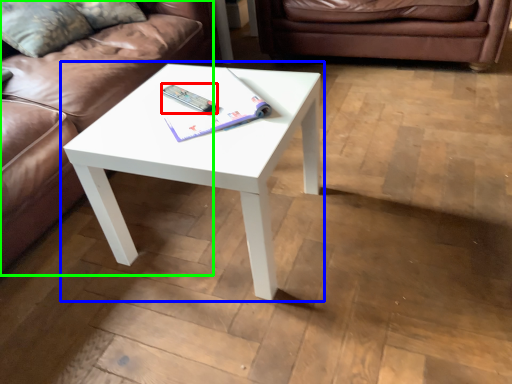
Question: Estimate the real-world distances between objects in this image. Which object is farther from remote (highlighted by a red box), coffee table (highlighted by a blue box) or studio couch (highlighted by a green box)?

Choices:
 (A) coffee table
 (B) studio couch

Answer: (B)